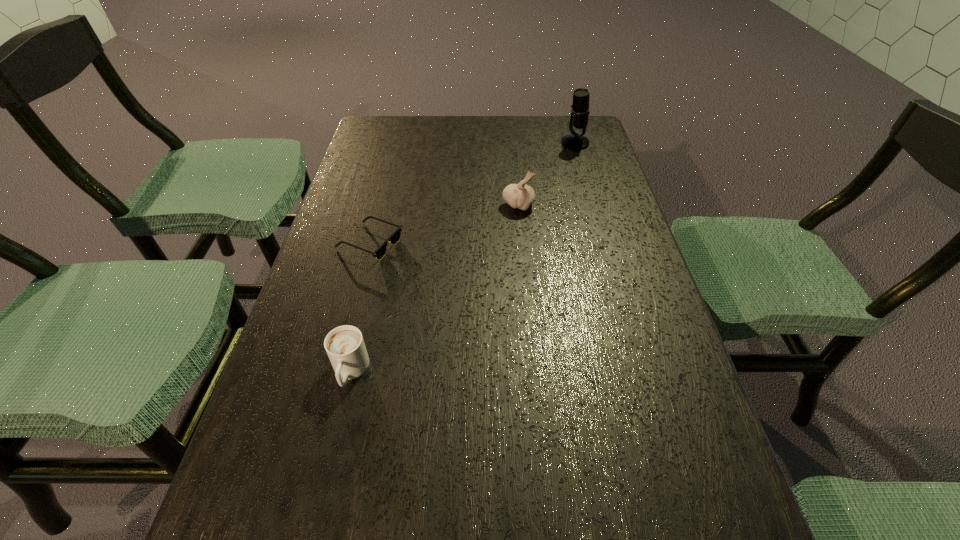
At what (x,y) coordinates should I click in order to perform the action: click on vacant space in between the nearest object and the sunglasses. Please return your answer as a coordinate pair (x, y). The width and height of the screenshot is (960, 540). Looking at the image, I should click on (360, 307).

Choose which object is the third nearest neighbor to the shortest object. Please provide its 2D coordinates. Your answer should be formatted as a tuple, i.e. [(x, y)], where the tuple contains the x and y coordinates of a point satisfying the conditions above.

[(580, 108)]

At what (x,y) coordinates should I click in order to perform the action: click on object that stands as the closest to the rightmost object. Please return your answer as a coordinate pair (x, y). Looking at the image, I should click on (521, 196).

The width and height of the screenshot is (960, 540). I want to click on vacant area that satisfies the following two spatial constraints: 1. on the front side of the garlic; 2. on the lenses of the sunglasses, so click(x=522, y=243).

The image size is (960, 540). Find the location of `vacant space that satisfies the following two spatial constraints: 1. on the front side of the third nearest object; 2. on the lenses of the sunglasses`. vacant space that satisfies the following two spatial constraints: 1. on the front side of the third nearest object; 2. on the lenses of the sunglasses is located at coordinates (522, 243).